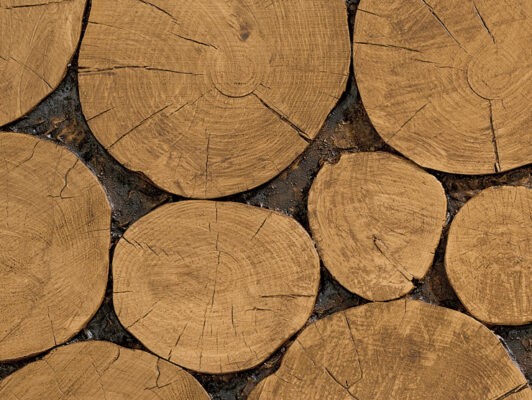
You are a GUI agent. You are given a task and a screenshot of the screen. Output one action in this format:
    pyautogui.click(x=<x>, y=<y>)
    Task: Click on the wood rounds
    Image resolution: width=532 pixels, height=400 pixels.
    Given the screenshot: What is the action you would take?
    point(109,375), point(28,238), point(28,79), point(228,113), point(211,266), point(381,229), point(383,339), point(521,280), point(454,35)